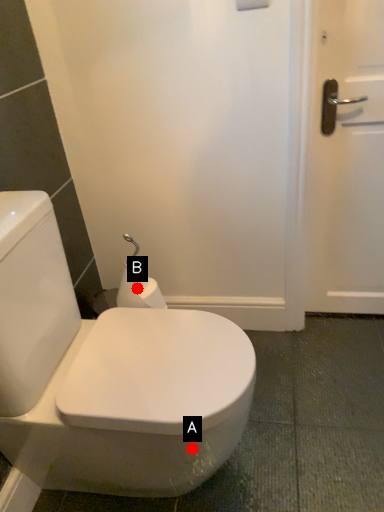
Question: Two points are circled on the image, labeled by A and B beside each circle. Which point is further to the camera?

Choices:
 (A) A is further
 (B) B is further

Answer: (B)